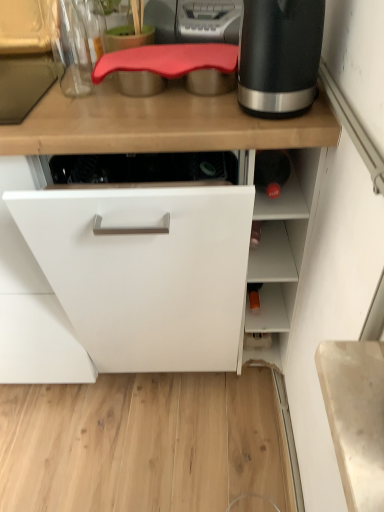
Question: Can you confirm if black matte electric kettle at upper right is thinner than rubberized red cutting board at upper center?

Choices:
 (A) yes
 (B) no

Answer: (A)

Question: Is black matte electric kettle at upper right positioned with its back to rubberized red cutting board at upper center?

Choices:
 (A) yes
 (B) no

Answer: (B)

Question: Can rubberized red cutting board at upper center be found inside black matte electric kettle at upper right?

Choices:
 (A) no
 (B) yes

Answer: (A)

Question: Is the depth of black matte electric kettle at upper right greater than that of rubberized red cutting board at upper center?

Choices:
 (A) yes
 (B) no

Answer: (B)

Question: Is black matte electric kettle at upper right to the right of rubberized red cutting board at upper center from the viewer's perspective?

Choices:
 (A) yes
 (B) no

Answer: (A)

Question: Would you consider black matte electric kettle at upper right to be distant from rubberized red cutting board at upper center?

Choices:
 (A) no
 (B) yes

Answer: (A)

Question: Is rubberized red cutting board at upper center not inside black matte electric kettle at upper right?

Choices:
 (A) yes
 (B) no

Answer: (A)

Question: Considering the relative sizes of rubberized red cutting board at upper center and black matte electric kettle at upper right in the image provided, is rubberized red cutting board at upper center shorter than black matte electric kettle at upper right?

Choices:
 (A) yes
 (B) no

Answer: (A)

Question: Can you confirm if rubberized red cutting board at upper center is thinner than black matte electric kettle at upper right?

Choices:
 (A) yes
 (B) no

Answer: (B)

Question: From a real-world perspective, is rubberized red cutting board at upper center over black matte electric kettle at upper right?

Choices:
 (A) no
 (B) yes

Answer: (A)

Question: Is rubberized red cutting board at upper center positioned behind black matte electric kettle at upper right?

Choices:
 (A) yes
 (B) no

Answer: (A)

Question: Can you confirm if rubberized red cutting board at upper center is positioned to the left of black matte electric kettle at upper right?

Choices:
 (A) yes
 (B) no

Answer: (A)

Question: Considering the relative positions of black matte electric kettle at upper right and rubberized red cutting board at upper center in the image provided, is black matte electric kettle at upper right to the left or to the right of rubberized red cutting board at upper center?

Choices:
 (A) left
 (B) right

Answer: (B)